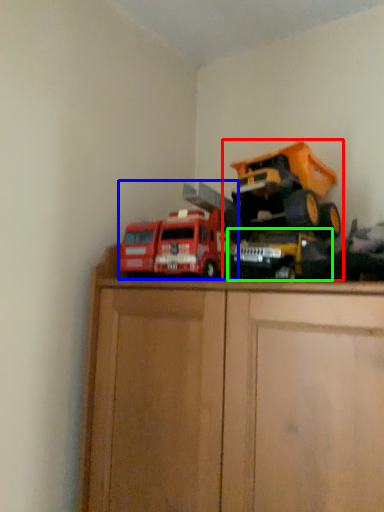
Question: Which object is positioned farthest from toy (highlighted by a red box)? Select from toy (highlighted by a blue box) and toy (highlighted by a green box).

Choices:
 (A) toy
 (B) toy

Answer: (A)